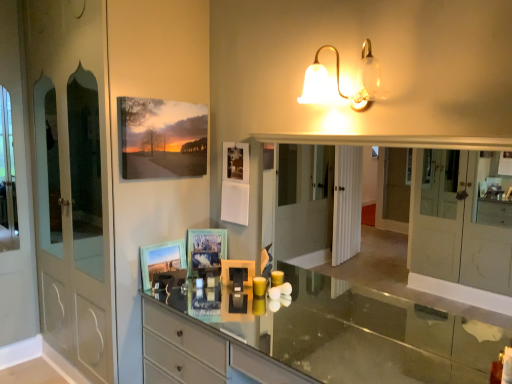
The width and height of the screenshot is (512, 384). I want to click on free space above smooth glass countertop at center (from a real-world perspective), so click(310, 334).